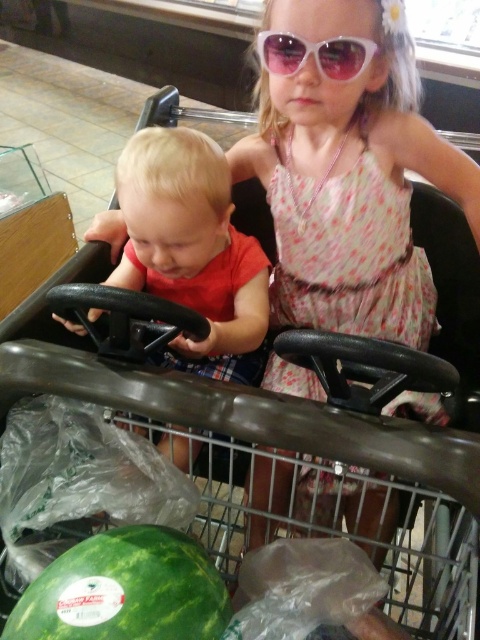
Question: Estimate the real-world distances between objects in this image. Which object is closer to the green matte watermelon at lower left?

Choices:
 (A) matte black steering wheel at left
 (B) white plastic goggles at upper center

Answer: (A)

Question: Among these points, which one is farthest from the camera?

Choices:
 (A) (149, 627)
 (B) (140, 288)
 (C) (309, 44)

Answer: (B)

Question: Is green matte watermelon at lower left positioned at the back of white plastic goggles at upper center?

Choices:
 (A) no
 (B) yes

Answer: (A)

Question: Observing the image, what is the correct spatial positioning of matte black steering wheel at left in reference to green matte watermelon at lower left?

Choices:
 (A) below
 (B) above

Answer: (B)

Question: From the image, what is the correct spatial relationship of matte black steering wheel at left in relation to green matte watermelon at lower left?

Choices:
 (A) below
 (B) above

Answer: (B)

Question: Which object appears farthest from the camera in this image?

Choices:
 (A) matte black steering wheel at left
 (B) white plastic goggles at upper center

Answer: (B)